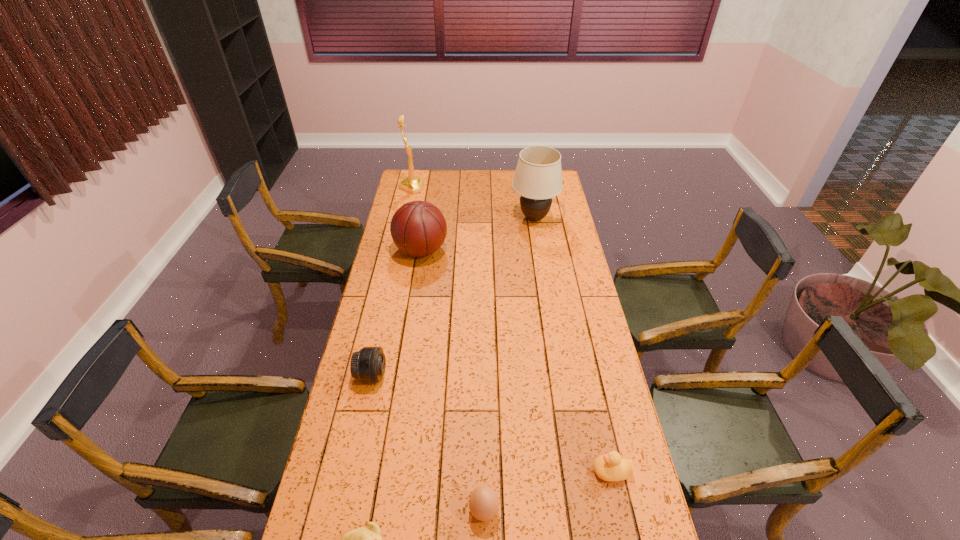
Identify the location of free space between the fourth farthest object and the farthest object. (392, 281).

Where is `free spot between the boiled egg and the fifth shortest object`? free spot between the boiled egg and the fifth shortest object is located at coordinates (452, 381).

You are a GUI agent. You are given a task and a screenshot of the screen. Output one action in this format:
    pyautogui.click(x=<x>, y=<y>)
    Task: Click on the object that ranks as the third closest to the farthest object
    This screenshot has height=540, width=960.
    Given the screenshot: What is the action you would take?
    pyautogui.click(x=368, y=365)

Choose which object is the sixth nearest neighbor to the farthest object. Please provide its 2D coordinates. Your answer should be formatted as a tuple, i.e. [(x, y)], where the tuple contains the x and y coordinates of a point satisfying the conditions above.

[(368, 539)]